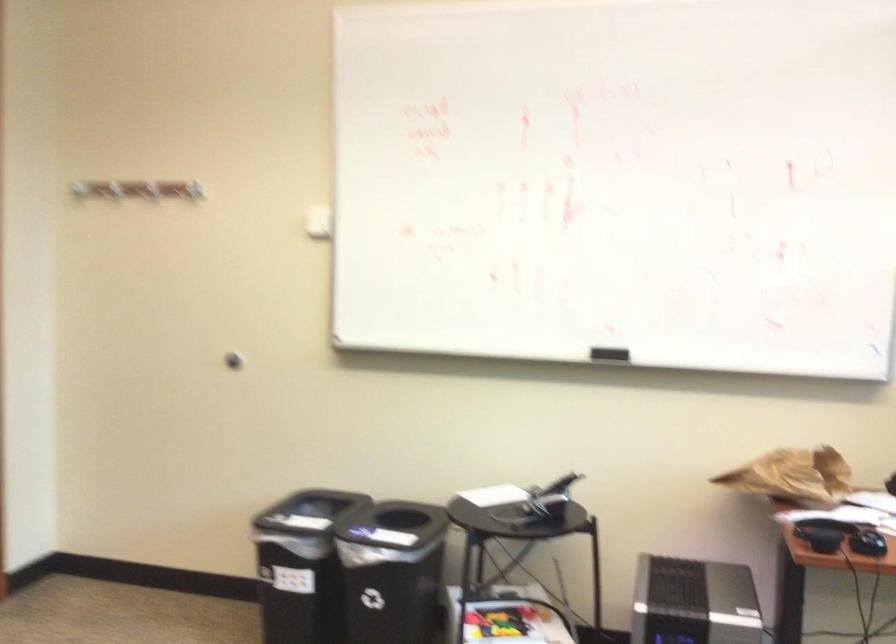
At what (x,y) coordinates should I click in order to perform the action: click on brown paper bag. Please return your answer as a coordinate pair (x, y). Looking at the image, I should click on (794, 476).